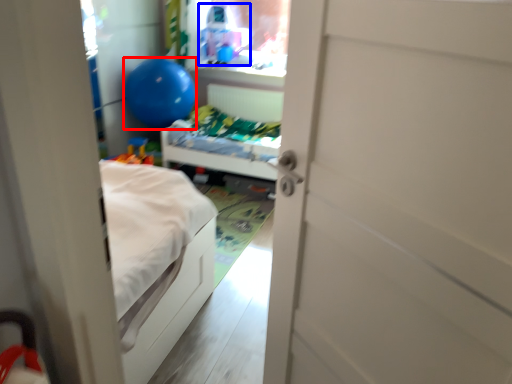
Question: Which object appears farthest to the camera in this image, balloon (highlighted by a red box) or toy (highlighted by a blue box)?

Choices:
 (A) balloon
 (B) toy

Answer: (B)